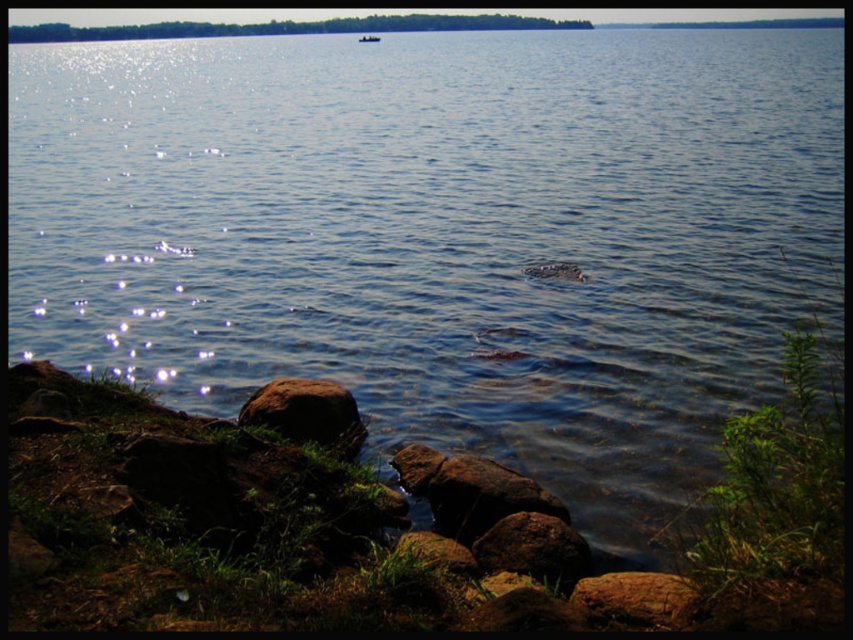
Question: Can you confirm if brown rough rock at lower center is positioned above metallic silver boat at upper center?

Choices:
 (A) no
 (B) yes

Answer: (A)

Question: Which of the following is the closest to the observer?

Choices:
 (A) (329, 404)
 (B) (549, 547)
 (C) (368, 35)
 (D) (662, 582)

Answer: (D)

Question: Which of the following is the farthest from the observer?

Choices:
 (A) (361, 35)
 (B) (316, 429)
 (C) (552, 556)
 (D) (612, 600)

Answer: (A)

Question: Does brown rough rock at lower left appear on the left side of brown rough rock at lower center?

Choices:
 (A) no
 (B) yes

Answer: (B)

Question: Among these objects, which one is farthest from the camera?

Choices:
 (A) brown rough rock at lower right
 (B) brown rough rock at lower center
 (C) brown rough rock at lower left

Answer: (C)

Question: Does brown rough rock at lower left have a smaller size compared to brown rough rock at lower center?

Choices:
 (A) no
 (B) yes

Answer: (A)